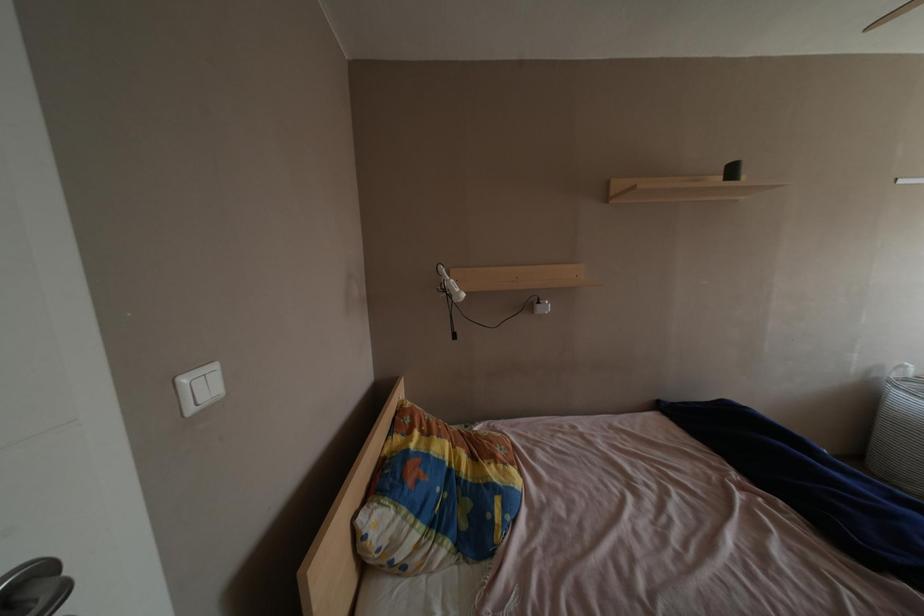
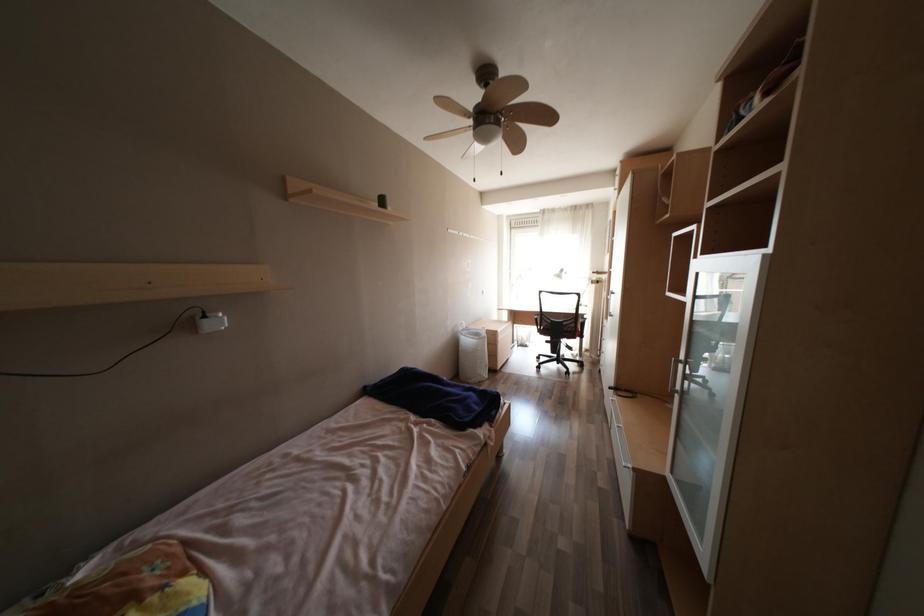
Question: The first image is from the beginning of the video and the second image is from the end. How did the camera likely rotate when shooting the video?

Choices:
 (A) Left
 (B) Right
 (C) Up
 (D) Down

Answer: (B)